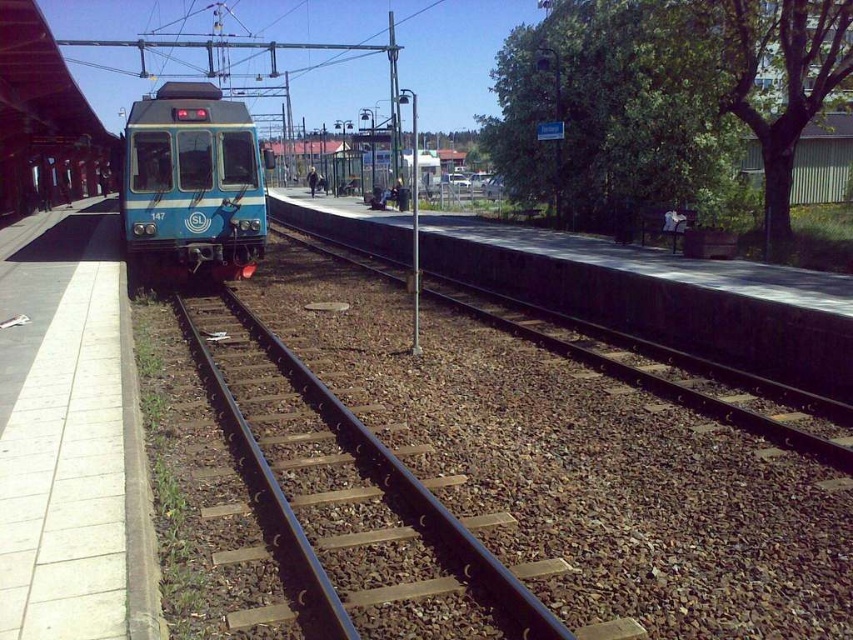
Does black metal track at center appear under blue glossy train at center?

Yes.

Does point (390, 541) lie in front of point (222, 154)?

That is True.

Between point (753, 477) and point (256, 166), which one is positioned behind?

Point (256, 166)

At what (x,y) coordinates should I click in order to perform the action: click on black metal track at center. Please return your answer as a coordinate pair (x, y). This screenshot has width=853, height=640. Looking at the image, I should click on (527, 468).

Between black metal track at center and black metal train track at center, which one has less height?

black metal train track at center

Can you confirm if black metal track at center is shorter than black metal train track at center?

In fact, black metal track at center may be taller than black metal train track at center.

Does point (387, 628) come in front of point (426, 490)?

That is True.

I want to click on black metal track at center, so click(x=527, y=468).

Is point (373, 522) closer to camera compared to point (221, 120)?

Yes.

Is the position of black metal train track at center more distant than that of blue glossy train at center?

No.

Who is more distant from viewer, (399,474) or (177,234)?

Positioned behind is point (177,234).

At what (x,y) coordinates should I click in order to perform the action: click on black metal train track at center. Please return your answer as a coordinate pair (x, y). Looking at the image, I should click on (349, 500).